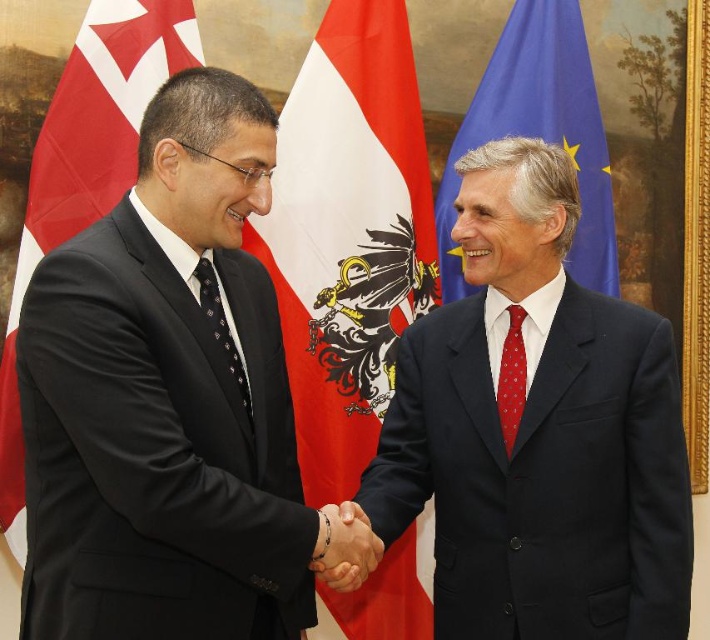
Based on the photo, is dark blue suit at center positioned in front of blue fabric flag at upper right?

Yes, dark blue suit at center is in front of blue fabric flag at upper right.

Which is more to the right, dark blue suit at center or blue fabric flag at upper right?

From the viewer's perspective, blue fabric flag at upper right appears more on the right side.

Does point (496, 157) come farther from viewer compared to point (520, 131)?

That is False.

Where is `dark blue suit at center`? The width and height of the screenshot is (710, 640). dark blue suit at center is located at coordinates (537, 432).

Is point (148, 198) in front of point (454, 442)?

That is True.

Image resolution: width=710 pixels, height=640 pixels. In order to click on black matte suit at left in this screenshot , I will do `click(163, 400)`.

Is red dotted fabric tie at center below black dotted tie at center?

Yes.

Does red dotted fabric tie at center have a larger size compared to black dotted tie at center?

Actually, red dotted fabric tie at center might be smaller than black dotted tie at center.

Identify the location of red dotted fabric tie at center. The width and height of the screenshot is (710, 640). (x=510, y=378).